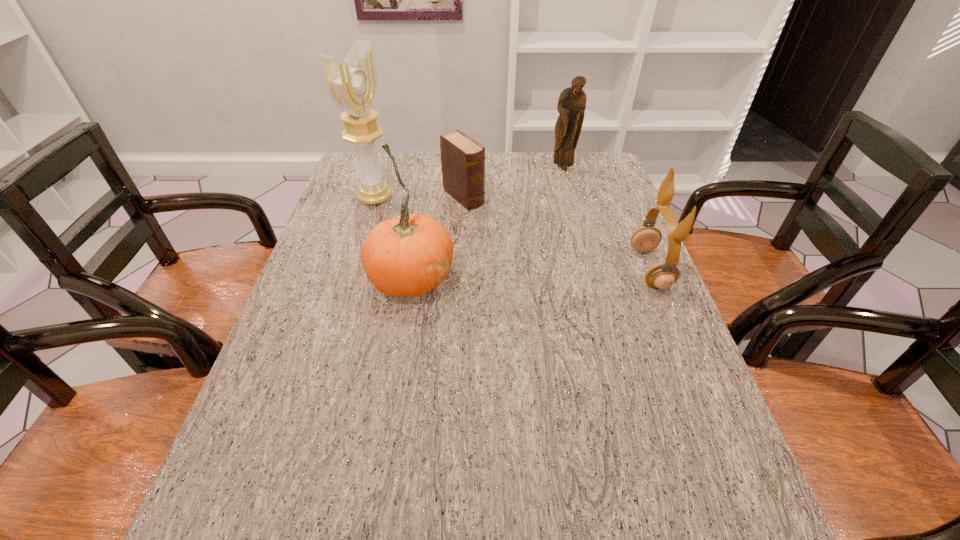
Identify the location of vacant space that satisfies the following two spatial constraints: 1. on the front side of the tallest object; 2. on the right side of the pumpkin. (351, 277).

This screenshot has height=540, width=960. I want to click on free space that satisfies the following two spatial constraints: 1. on the front side of the figurine; 2. on the front-facing side of the earphone, so click(x=588, y=269).

You are a GUI agent. You are given a task and a screenshot of the screen. Output one action in this format:
    pyautogui.click(x=<x>, y=<y>)
    Task: Click on the free space that satisfies the following two spatial constraints: 1. on the back side of the shortest object; 2. on the right side of the tallest object
    Image resolution: width=960 pixels, height=540 pixels.
    Given the screenshot: What is the action you would take?
    pyautogui.click(x=375, y=197)

The image size is (960, 540). I want to click on free space that satisfies the following two spatial constraints: 1. on the back side of the pumpkin; 2. on the left side of the figurine, so click(429, 169).

I want to click on vacant space that satisfies the following two spatial constraints: 1. on the front side of the shortest object; 2. on the front-facing side of the earphone, so click(460, 269).

Find the location of a particular element. free point that satisfies the following two spatial constraints: 1. on the front side of the second shortest object; 2. on the front-facing side of the figurine is located at coordinates pos(588,269).